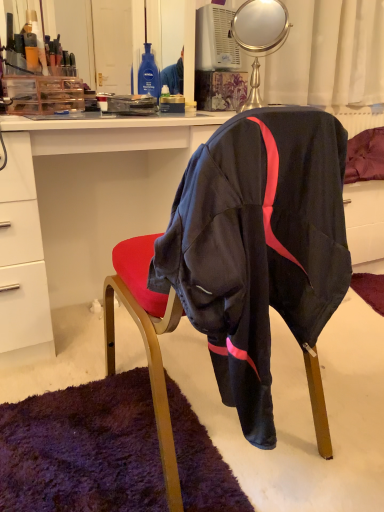
Locate an element on the screen. The image size is (384, 512). white glossy desk at center is located at coordinates (91, 189).

The image size is (384, 512). What are the coordinates of `white glossy desk at center` in the screenshot? It's located at (91, 189).

From a real-world perspective, is white glossy desk at center positioned over black fabric chair at center based on gravity?

Incorrect, from a real-world perspective, white glossy desk at center is lower than black fabric chair at center.

Considering the points (355, 253) and (208, 291), which point is in front, point (355, 253) or point (208, 291)?

The point (208, 291) is more forward.

Could black fabric chair at center be considered to be inside white glossy desk at center?

No, white glossy desk at center does not contain black fabric chair at center.

Locate an element on the screen. mirror to the right of black fabric chair at center is located at coordinates (259, 37).

How different are the orientations of metallic gold mirror at upper center and black fabric chair at center in degrees?

The angle between the facing direction of metallic gold mirror at upper center and the facing direction of black fabric chair at center is 131 degrees.

From the image's perspective, is metallic gold mirror at upper center located above black fabric chair at center?

Indeed, from the image's perspective, metallic gold mirror at upper center is shown above black fabric chair at center.

Does metallic gold mirror at upper center have a lesser width compared to black fabric chair at center?

Yes, metallic gold mirror at upper center is thinner than black fabric chair at center.

Between metallic gold mirror at upper center and white glossy desk at center, which one has smaller width?

With smaller width is metallic gold mirror at upper center.

Is metallic gold mirror at upper center to the right of white glossy desk at center from the viewer's perspective?

Correct, you'll find metallic gold mirror at upper center to the right of white glossy desk at center.

Between metallic gold mirror at upper center and white glossy desk at center, which one has more height?

white glossy desk at center.

From a real-world perspective, is white glossy desk at center located higher than metallic gold mirror at upper center?

Incorrect, from a real-world perspective, white glossy desk at center is lower than metallic gold mirror at upper center.

Is white glossy desk at center looking in the opposite direction of metallic gold mirror at upper center?

No, white glossy desk at center is not facing the opposite direction of metallic gold mirror at upper center.

From the image's perspective, which one is positioned higher, white glossy desk at center or metallic gold mirror at upper center?

metallic gold mirror at upper center.

Can you confirm if white glossy desk at center is shorter than metallic gold mirror at upper center?

Incorrect, the height of white glossy desk at center does not fall short of that of metallic gold mirror at upper center.

Is black fabric chair at center at the left side of white glossy desk at center?

In fact, black fabric chair at center is to the right of white glossy desk at center.

Considering the positions of objects black fabric chair at center and white glossy desk at center in the image provided, who is in front, black fabric chair at center or white glossy desk at center?

black fabric chair at center is in front.

From the image's perspective, is black fabric chair at center beneath white glossy desk at center?

Yes.

Which of these two, black fabric chair at center or white glossy desk at center, is wider?

Wider between the two is white glossy desk at center.

Visually, is black fabric chair at center positioned to the left or to the right of metallic gold mirror at upper center?

black fabric chair at center is to the left of metallic gold mirror at upper center.

From the image's perspective, which one is positioned lower, black fabric chair at center or metallic gold mirror at upper center?

black fabric chair at center is shown below in the image.

Looking at their sizes, would you say black fabric chair at center is wider or thinner than metallic gold mirror at upper center?

Considering their sizes, black fabric chair at center looks broader than metallic gold mirror at upper center.

You are a GUI agent. You are given a task and a screenshot of the screen. Output one action in this format:
    pyautogui.click(x=<x>, y=<y>)
    Task: Click on the desk below the black fabric chair at center (from a real-world perspective)
    This screenshot has width=384, height=512.
    Given the screenshot: What is the action you would take?
    pyautogui.click(x=91, y=189)

You are a GUI agent. You are given a task and a screenshot of the screen. Output one action in this format:
    pyautogui.click(x=<x>, y=<y>)
    Task: Click on the chair on the left of metallic gold mirror at upper center
    This screenshot has width=384, height=512.
    Given the screenshot: What is the action you would take?
    pyautogui.click(x=243, y=264)

Based on the photo, from the image, which object appears to be farther from black fabric chair at center, white glossy desk at center or metallic gold mirror at upper center?

Based on the image, metallic gold mirror at upper center appears to be further to black fabric chair at center.

From the image, which object appears to be nearer to metallic gold mirror at upper center, white glossy desk at center or black fabric chair at center?

white glossy desk at center is positioned closer to the anchor metallic gold mirror at upper center.

When comparing their distances from black fabric chair at center, does metallic gold mirror at upper center or white glossy desk at center seem further?

Based on the image, metallic gold mirror at upper center appears to be further to black fabric chair at center.

Looking at the image, which one is located further to white glossy desk at center, black fabric chair at center or metallic gold mirror at upper center?

metallic gold mirror at upper center lies further to white glossy desk at center than the other object.

Based on their spatial positions, is metallic gold mirror at upper center or black fabric chair at center further from white glossy desk at center?

Based on the image, metallic gold mirror at upper center appears to be further to white glossy desk at center.

When comparing their distances from metallic gold mirror at upper center, does black fabric chair at center or white glossy desk at center seem closer?

white glossy desk at center is closer to metallic gold mirror at upper center.

Where is `desk between black fabric chair at center and metallic gold mirror at upper center in the front-back direction`? desk between black fabric chair at center and metallic gold mirror at upper center in the front-back direction is located at coordinates (91, 189).